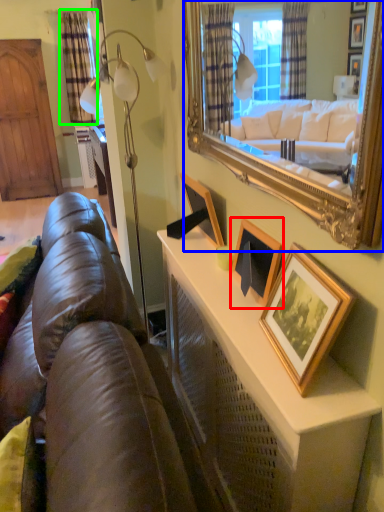
Question: Considering the real-world distances, which object is closest to picture frame (highlighted by a red box)? mirror (highlighted by a blue box) or curtain (highlighted by a green box).

Choices:
 (A) mirror
 (B) curtain

Answer: (A)